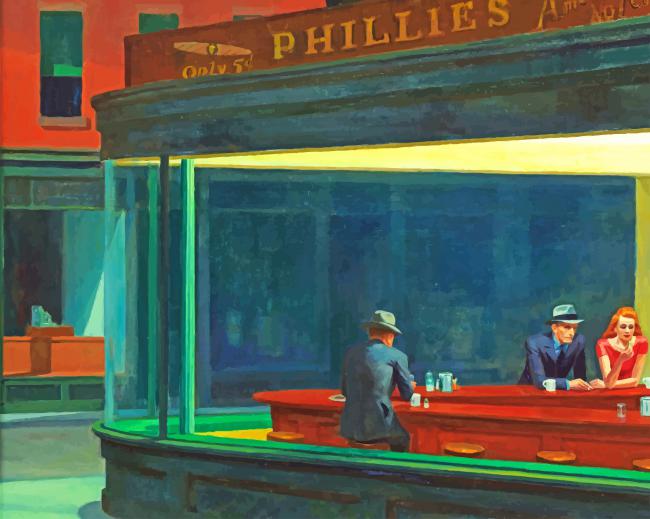
The image size is (650, 519). Identify the location of salt shaker. click(428, 403), click(439, 384).